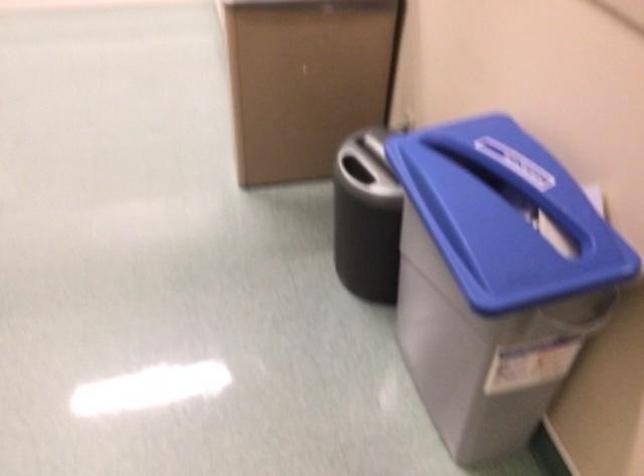
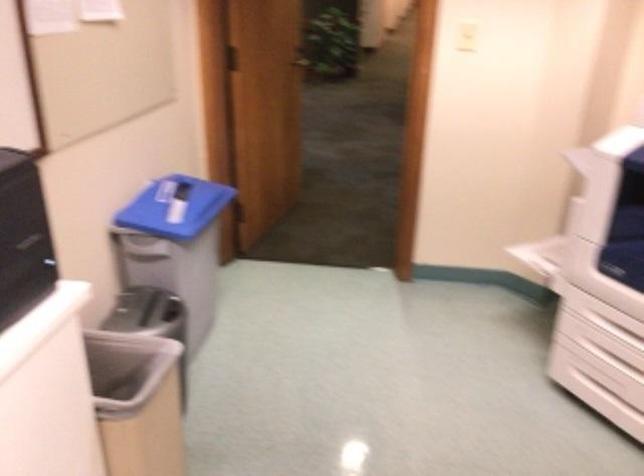
In the second image, find the point that corresponds to the point at 516,242 in the first image.

(174, 207)